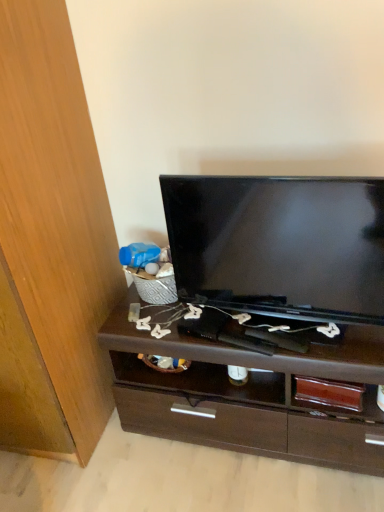
Question: Considering the positions of point (382, 263) and point (172, 391), is point (382, 263) closer or farther from the camera than point (172, 391)?

Choices:
 (A) closer
 (B) farther

Answer: (A)

Question: In terms of size, does black glossy television at center appear bigger or smaller than dark brown wood chest of drawers at center?

Choices:
 (A) small
 (B) big

Answer: (A)

Question: Which object is positioned closest to the wooden cabinet at left?

Choices:
 (A) dark brown wood chest of drawers at center
 (B) black glossy television at center

Answer: (A)

Question: Which object is positioned closest to the dark brown wood chest of drawers at center?

Choices:
 (A) black glossy television at center
 (B) wooden cabinet at left

Answer: (A)